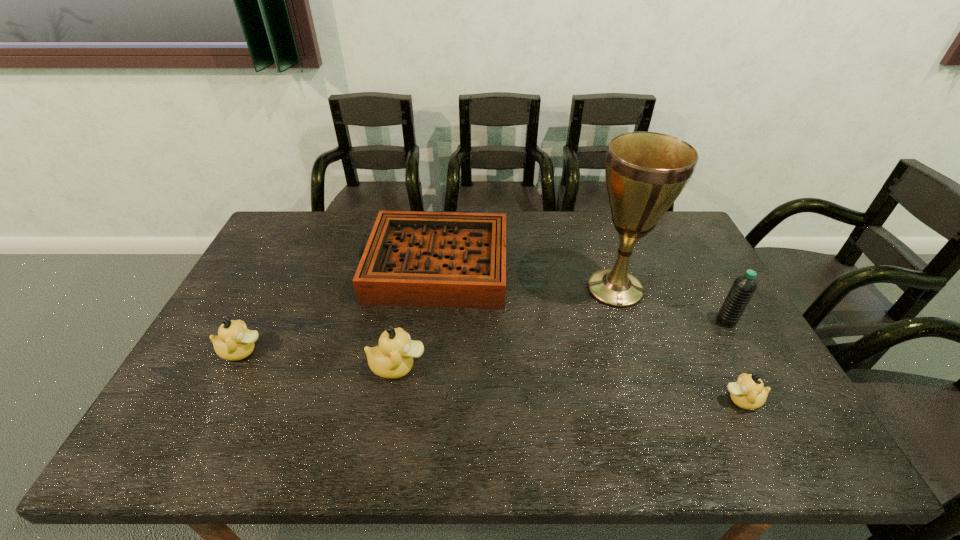
If equal spacing is the goal by inserting an additional duckling among them, please point out a vacant space for this new duckling. Please provide its 2D coordinates. Your answer should be formatted as a tuple, i.e. [(x, y)], where the tuple contains the x and y coordinates of a point satisfying the conditions above.

[(564, 383)]